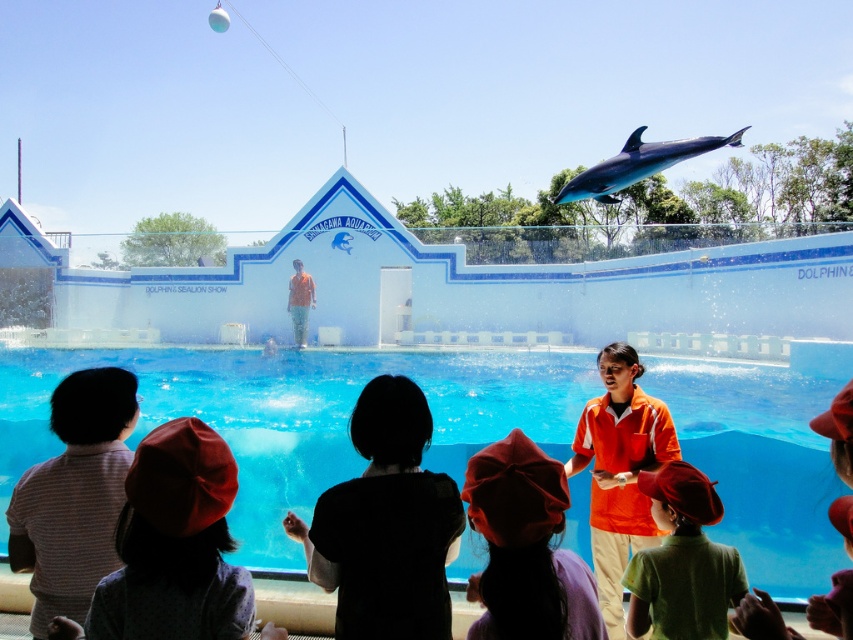
From the picture: Does transparent glass pool at center appear on the left side of shiny blue dolphin at upper center?

Yes, transparent glass pool at center is to the left of shiny blue dolphin at upper center.

The height and width of the screenshot is (640, 853). What are the coordinates of `transparent glass pool at center` in the screenshot? It's located at (300, 416).

I want to click on transparent glass pool at center, so click(300, 416).

Who is more forward, (434, 417) or (334, 486)?

Point (334, 486) is more forward.

Which is more to the left, transparent glass pool at center or orange fabric trainer at center?

transparent glass pool at center is more to the left.

Does point (172, 394) come in front of point (378, 444)?

No, (172, 394) is behind (378, 444).

This screenshot has width=853, height=640. I want to click on transparent glass pool at center, so click(300, 416).

Between red fabric hat at lower left and red fabric hat at lower center, which one appears on the right side from the viewer's perspective?

red fabric hat at lower center is more to the right.

Which is in front, point (123, 579) or point (479, 506)?

Point (479, 506) is more forward.

Measure the distance between point (195, 461) and camera.

The distance of point (195, 461) from camera is 2.69 meters.

Identify the location of red fabric hat at lower left. The height and width of the screenshot is (640, 853). (172, 547).